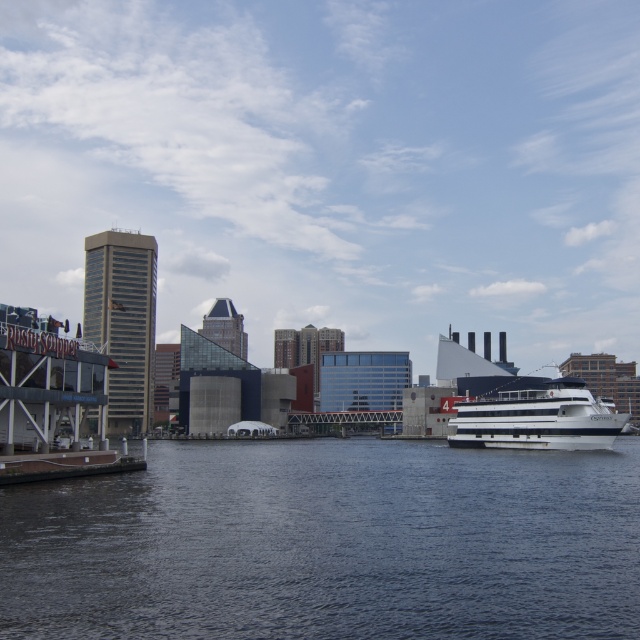
Question: Is dark blue water at center wider than white glossy cruise ship at right?

Choices:
 (A) yes
 (B) no

Answer: (A)

Question: Which point is farther to the camera?

Choices:
 (A) (120, 634)
 (B) (472, 429)

Answer: (B)

Question: In this image, where is dark blue water at center located relative to white glossy cruise ship at right?

Choices:
 (A) above
 (B) below

Answer: (B)

Question: Which object appears farthest from the camera in this image?

Choices:
 (A) dark blue water at center
 (B) white glossy cruise ship at right

Answer: (B)

Question: Does dark blue water at center have a lesser width compared to white glossy cruise ship at right?

Choices:
 (A) no
 (B) yes

Answer: (A)